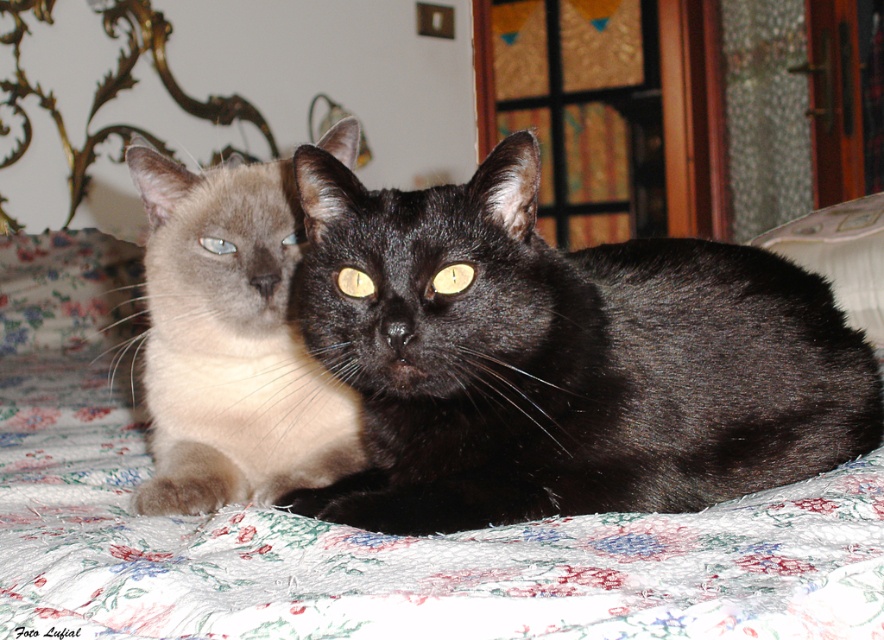
Question: Can you confirm if black glossy cat at center is bigger than matte cream cat at center?

Choices:
 (A) no
 (B) yes

Answer: (A)

Question: Does black glossy cat at center come behind matte cream cat at center?

Choices:
 (A) yes
 (B) no

Answer: (B)

Question: Does black glossy cat at center have a greater width compared to matte cream cat at center?

Choices:
 (A) no
 (B) yes

Answer: (B)

Question: Which point is closer to the camera?

Choices:
 (A) black glossy cat at center
 (B) matte cream cat at center

Answer: (A)